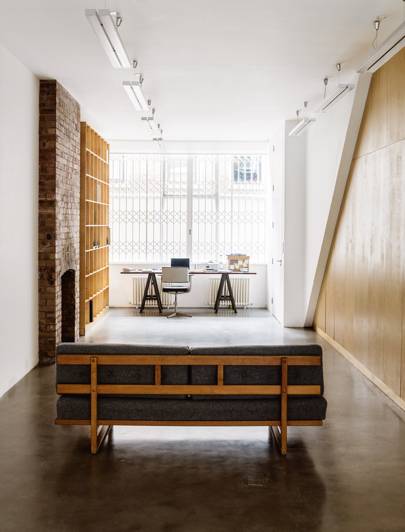
Find the location of a particular element. white walls is located at coordinates (319, 159), (26, 265), (234, 62).